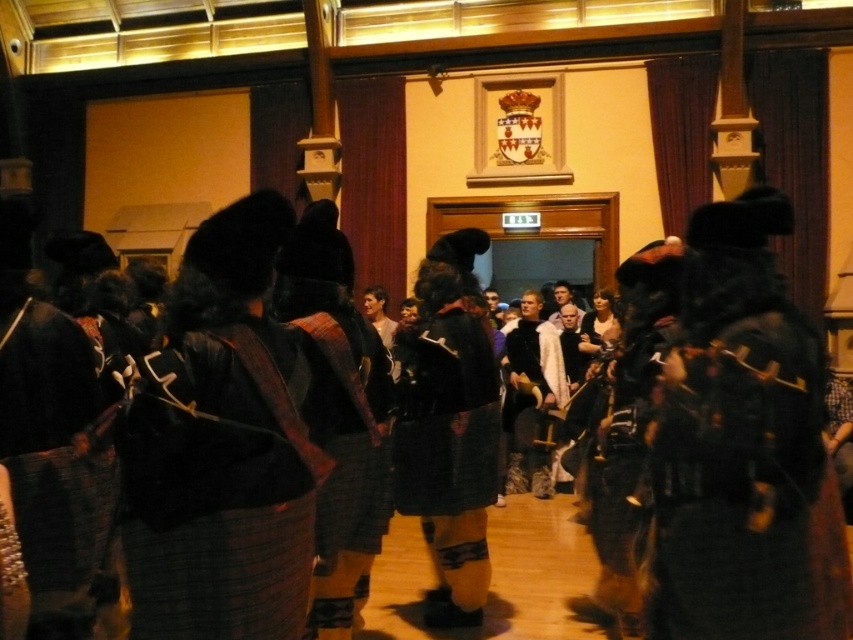
Does velvet black kilt at right have a greater width compared to plaid wool kilt at center?

Correct, the width of velvet black kilt at right exceeds that of plaid wool kilt at center.

I want to click on velvet black kilt at right, so click(x=743, y=445).

The height and width of the screenshot is (640, 853). Find the location of `velvet black kilt at right`. velvet black kilt at right is located at coordinates (743, 445).

Which of these two, plaid wool kilt at center or black woolen kilt at center, stands shorter?

Standing shorter between the two is plaid wool kilt at center.

At what (x,y) coordinates should I click in order to perform the action: click on plaid wool kilt at center. Please return your answer as a coordinate pair (x, y). Looking at the image, I should click on (221, 448).

The height and width of the screenshot is (640, 853). I want to click on plaid wool kilt at center, so click(221, 448).

Does velvet black kilt at right have a greater height compared to black woolen kilt at center?

Yes.

Where is `velvet black kilt at right`? The height and width of the screenshot is (640, 853). velvet black kilt at right is located at coordinates (743, 445).